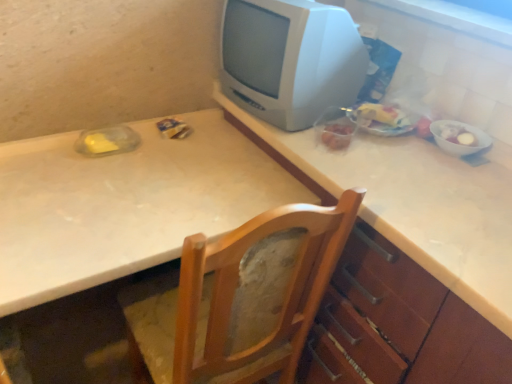
Where is `blank space situated above white glossy window sill at upper right (from a real-world perspective)`? The height and width of the screenshot is (384, 512). blank space situated above white glossy window sill at upper right (from a real-world perspective) is located at coordinates (466, 11).